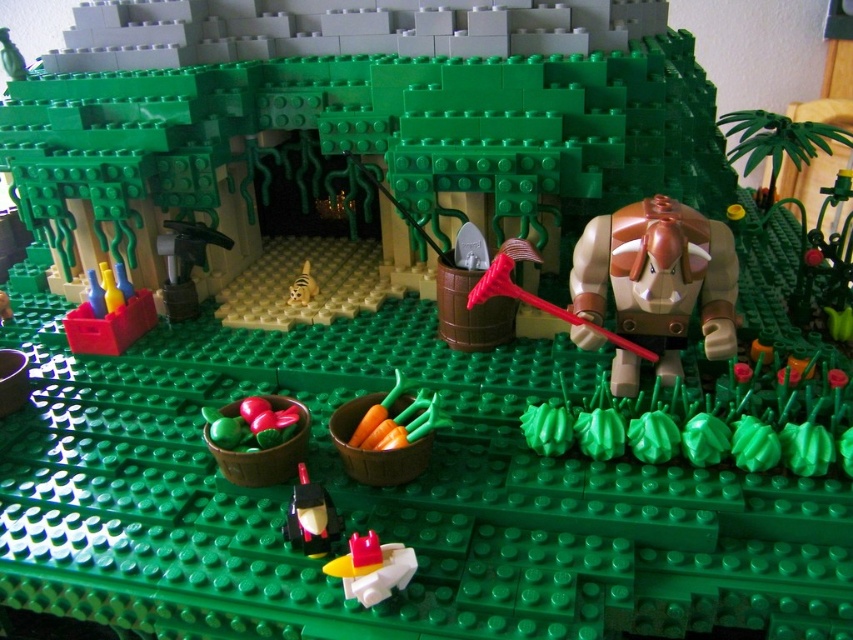
You are a visitor to this LEGO farm diorama. You want to place a new LEGO tree exactly at the center of the scene. However, there is already a translucent yellow plastic spaceship at center. Is the spaceship blocking the exact center of the scene?

The translucent yellow plastic spaceship at center is located at point (372, 568), which is not exactly the center of the scene since the true center would be at coordinates like (426, 320). Therefore, the spaceship is not blocking the exact center, so you can place the tree there.